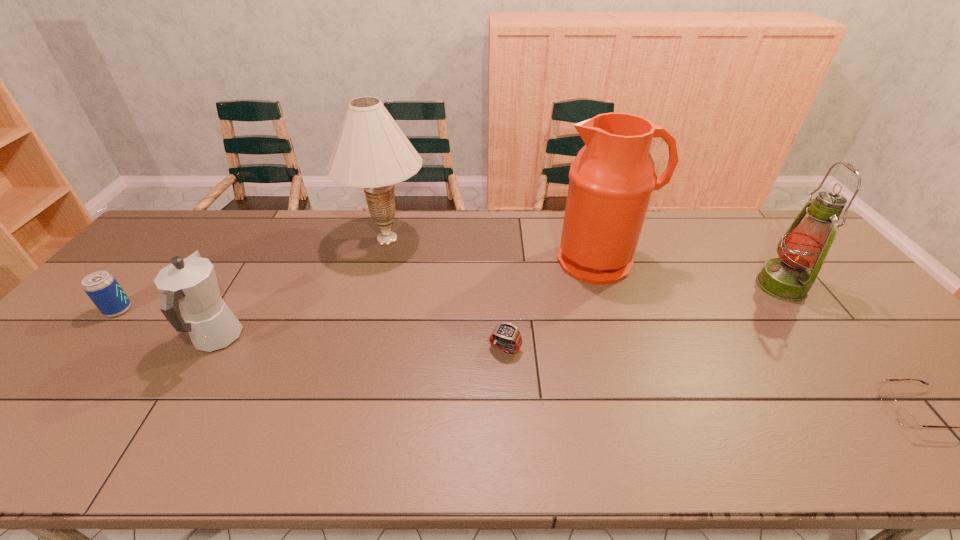
What are the coordinates of `vacant space situated 0.390m from the spout of the water jug` in the screenshot? It's located at (646, 401).

The image size is (960, 540). I want to click on vacant space located on the back of the oil lamp, so click(746, 240).

Identify the location of vacant space located 0.110m on the left of the second object from left to right. (151, 339).

Where is `vacant space located 0.160m on the front of the third shortest object`? The width and height of the screenshot is (960, 540). vacant space located 0.160m on the front of the third shortest object is located at coordinates (69, 367).

This screenshot has width=960, height=540. I want to click on vacant region located on the back of the watch, so click(500, 255).

Find the location of a particular element. The width and height of the screenshot is (960, 540). lampshade at the far edge is located at coordinates (371, 152).

Where is `water jug present at the far edge`? This screenshot has width=960, height=540. water jug present at the far edge is located at coordinates (612, 178).

Locate an element on the screen. Image resolution: width=960 pixels, height=540 pixels. object positioned at the left edge is located at coordinates (102, 288).

Locate an element on the screen. This screenshot has width=960, height=540. object present at the right edge is located at coordinates (805, 245).

The height and width of the screenshot is (540, 960). I want to click on free spot at the far edge of the desktop, so click(540, 224).